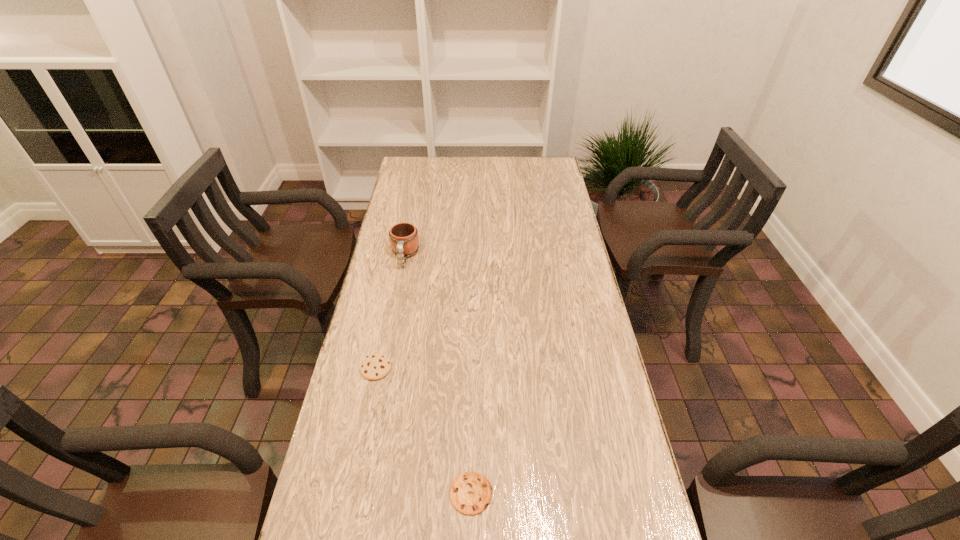
In order to click on vacant point that satisfies the following two spatial constraints: 1. on the side of the farthest object with the handle; 2. on the right side of the shortest object in this screenshot , I will do `click(359, 493)`.

At what (x,y) coordinates should I click in order to perform the action: click on vacant region that satisfies the following two spatial constraints: 1. on the side of the rightmost object with the handle; 2. on the right side of the mug. Please return your answer as a coordinate pair (x, y). The width and height of the screenshot is (960, 540). Looking at the image, I should click on (359, 493).

Locate an element on the screen. free location that satisfies the following two spatial constraints: 1. on the side of the nearer cookie with the handle; 2. on the left side of the tallest object is located at coordinates (359, 493).

Identify the location of vacant position in the image that satisfies the following two spatial constraints: 1. on the side of the shorter cookie with the handle; 2. on the right side of the mug. The width and height of the screenshot is (960, 540). (359, 493).